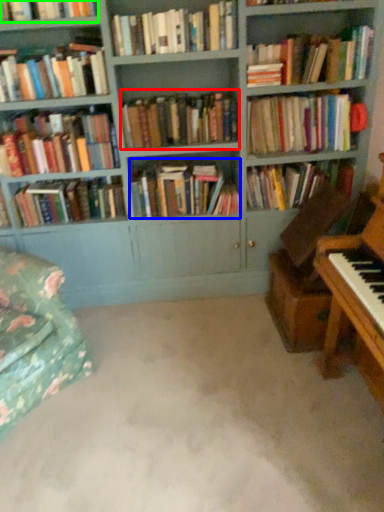
Question: Which object is positioned closest to book (highlighted by a red box)? Select from book (highlighted by a blue box) and book (highlighted by a green box).

Choices:
 (A) book
 (B) book

Answer: (A)